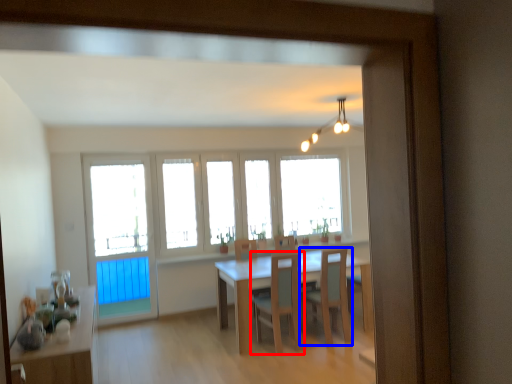
Question: Which of the following is the farthest to the observer, chair (highlighted by a red box) or chair (highlighted by a blue box)?

Choices:
 (A) chair
 (B) chair

Answer: (B)